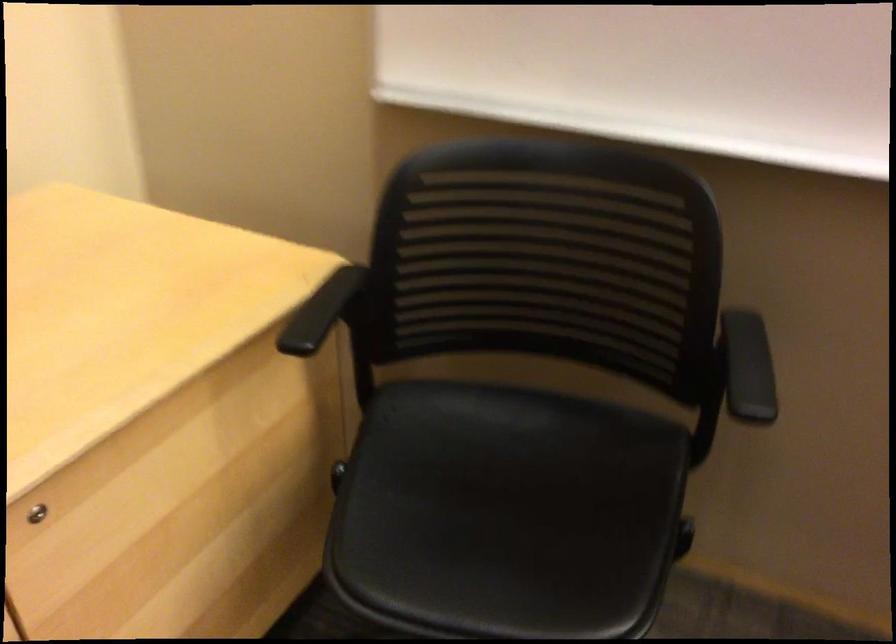
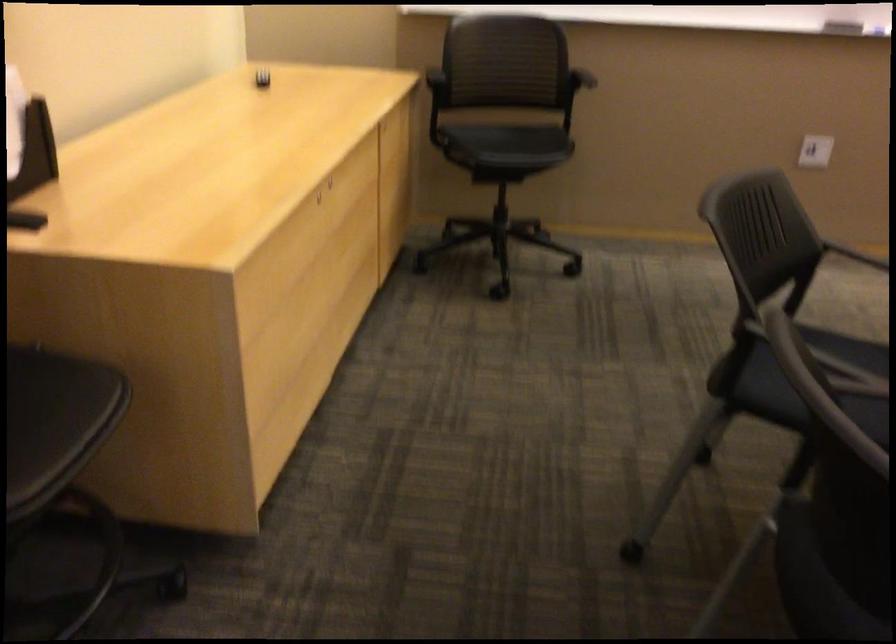
Locate, in the second image, the point that corresponds to [747,368] in the first image.

(589, 89)